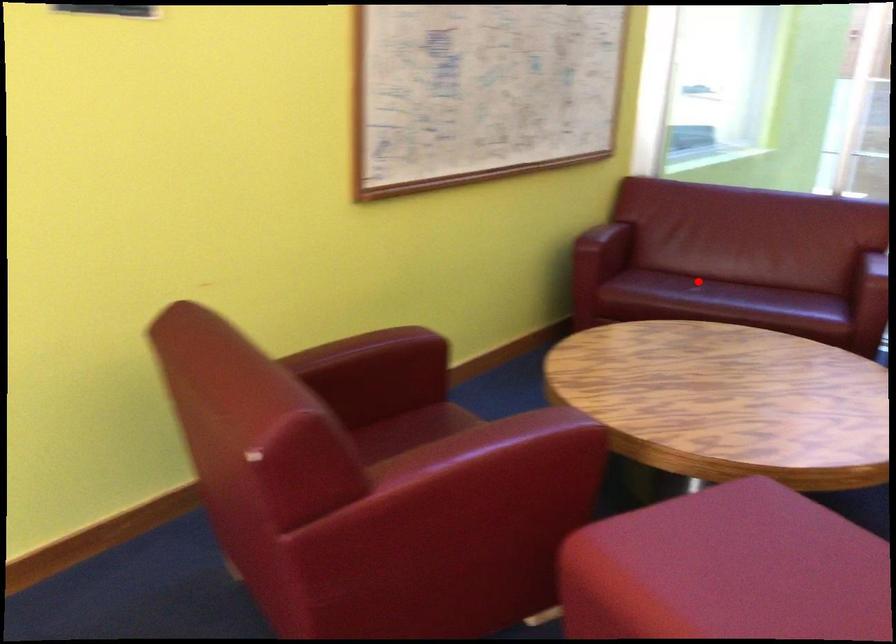
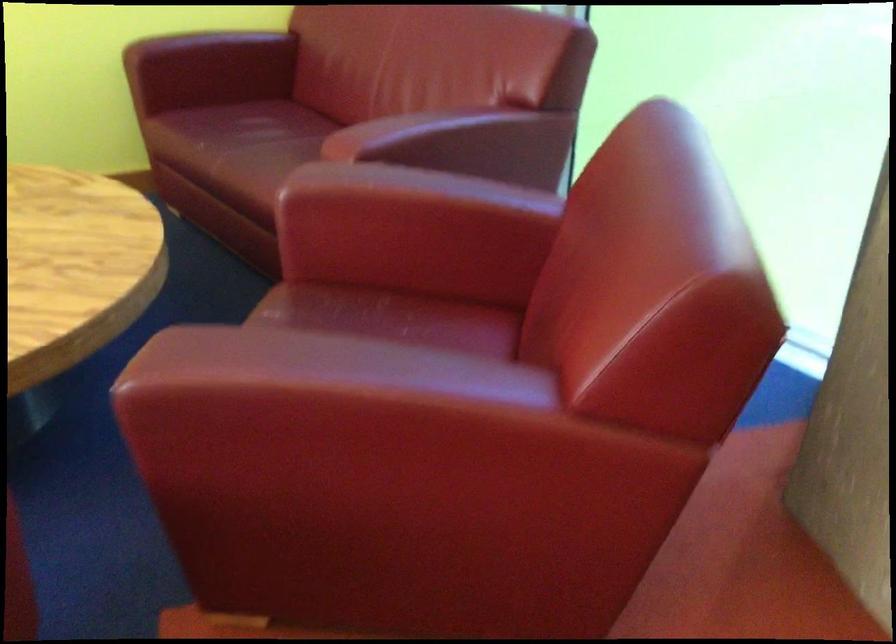
Where in the second image is the point corresponding to the highlighted location from the first image?

(263, 131)